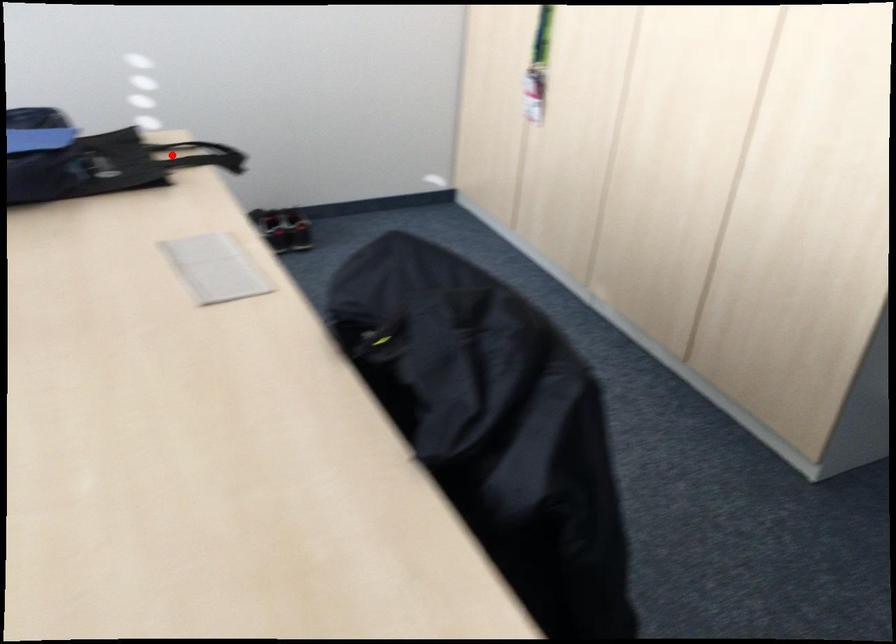
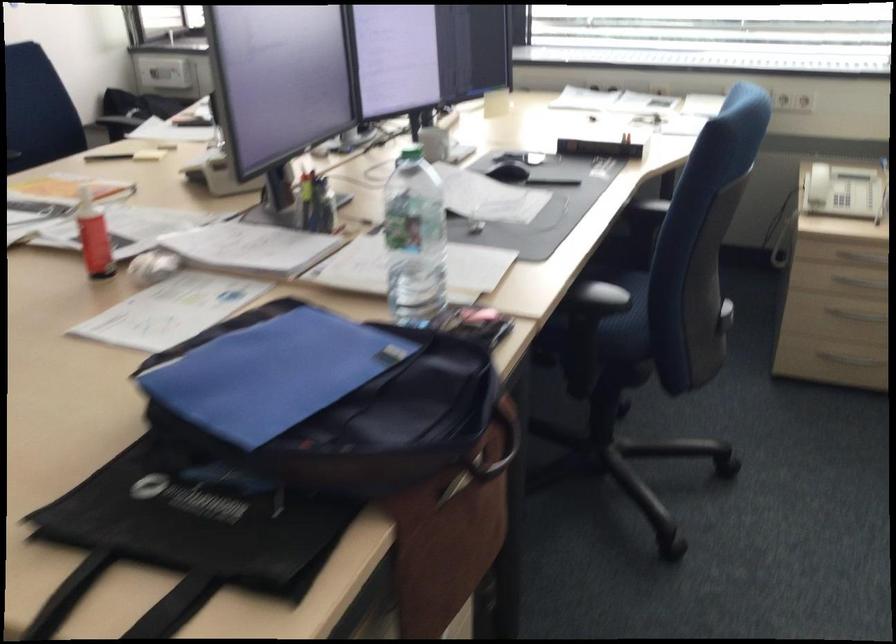
Question: I am providing you with two images of the same scene from different viewpoints. Image1 has a red point marked. In image2, the corresponding 3D location appears at what relative position? Reply with the corresponding letter.

Choices:
 (A) Closer
 (B) Farther

Answer: (A)